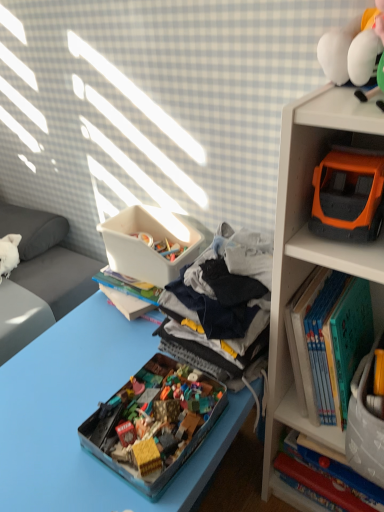
Locate an element on the screen. The image size is (384, 512). vacant area situated to the left side of translucent plastic toy box at center is located at coordinates (52, 421).